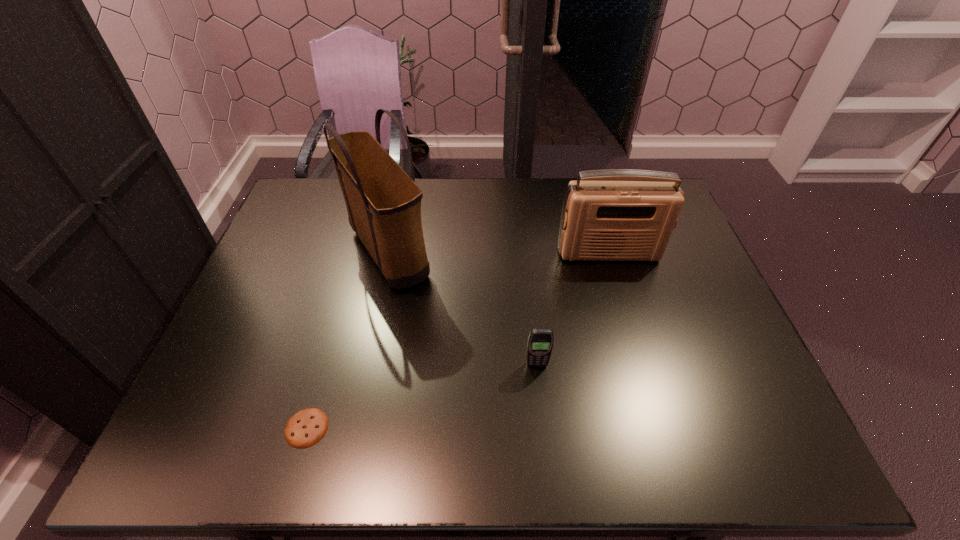
Image resolution: width=960 pixels, height=540 pixels. I want to click on the second closest object to the tallest object, so click(x=305, y=428).